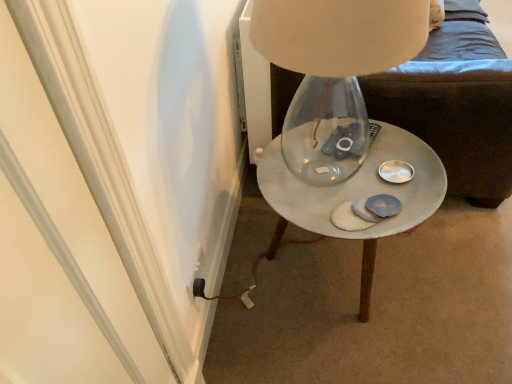
I want to click on vacant space in white marble side table at center (from a real-world perspective), so click(321, 265).